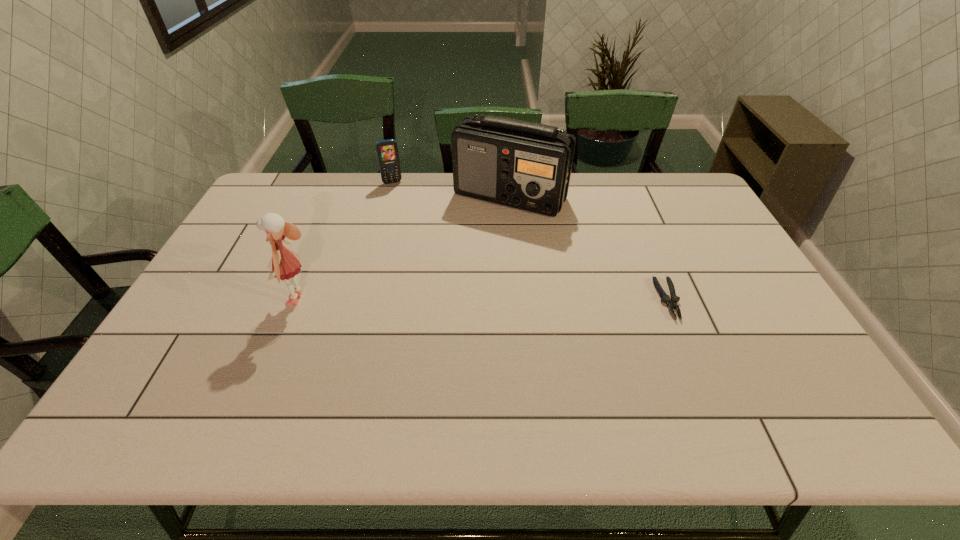
Identify the location of vacant area that lies between the second object from left to right and the shortest object. Image resolution: width=960 pixels, height=540 pixels. (530, 241).

What are the coordinates of `free area in between the third tallest object and the pliers` in the screenshot? It's located at (530, 241).

At what (x,y) coordinates should I click in order to perform the action: click on vacant area that lies between the cellular telephone and the rightmost object. Please return your answer as a coordinate pair (x, y). Looking at the image, I should click on (530, 241).

You are a GUI agent. You are given a task and a screenshot of the screen. Output one action in this format:
    pyautogui.click(x=<x>, y=<y>)
    Task: Click on the free space between the doll and the radio receiver
    
    Given the screenshot: What is the action you would take?
    pyautogui.click(x=405, y=248)

The height and width of the screenshot is (540, 960). Identify the location of object that stands as the third closest to the third tallest object. (671, 302).

Locate an element on the screen. object that is the second nearest to the third object from left to right is located at coordinates (671, 302).